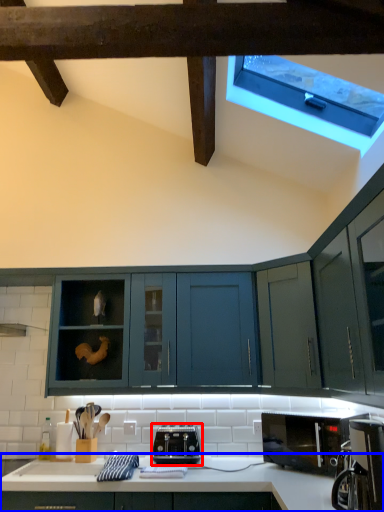
Question: Which of the following is the farthest to the observer, toaster (highlighted by a red box) or countertop (highlighted by a blue box)?

Choices:
 (A) toaster
 (B) countertop

Answer: (A)